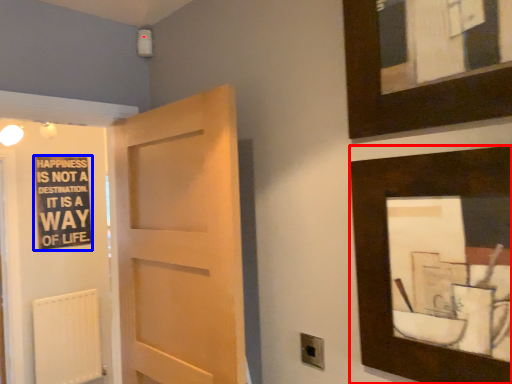
Question: Which point is closer to the camera, picture frame (highlighted by a red box) or bulletin board (highlighted by a blue box)?

Choices:
 (A) picture frame
 (B) bulletin board

Answer: (A)